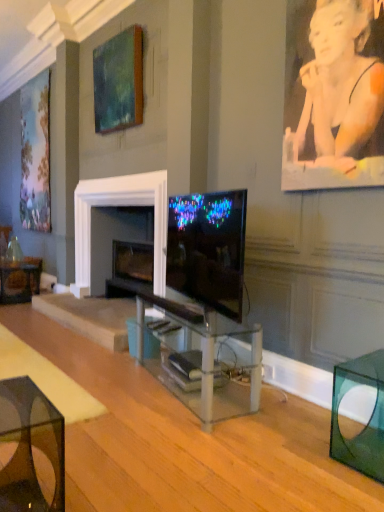
Question: Which direction should I rotate to look at teal matte painting at upper center, arranged as the 2th picture frame when viewed from the left?

Choices:
 (A) right
 (B) left

Answer: (B)

Question: From a real-world perspective, does transparent glass table at lower left, arranged as the second table when viewed from the left, sit lower than transparent glass cube at lower right, the 1th table positioned from the right?

Choices:
 (A) no
 (B) yes

Answer: (B)

Question: Is transparent glass table at lower left, positioned as the third table in right-to-left order, facing away from transparent glass cube at lower right, the 1th table positioned from the right?

Choices:
 (A) yes
 (B) no

Answer: (B)

Question: Considering the relative sizes of transparent glass table at lower left, which ranks as the 1th table in front-to-back order, and transparent glass cube at lower right, the 2th table in the front-to-back sequence, in the image provided, is transparent glass table at lower left, which ranks as the 1th table in front-to-back order, bigger than transparent glass cube at lower right, the 2th table in the front-to-back sequence,?

Choices:
 (A) no
 (B) yes

Answer: (A)

Question: From a real-world perspective, is transparent glass table at lower left, which ranks as the 1th table in front-to-back order, located higher than transparent glass cube at lower right, the 1th table positioned from the right?

Choices:
 (A) no
 (B) yes

Answer: (A)

Question: Considering the relative sizes of transparent glass table at lower left, positioned as the third table in right-to-left order, and transparent glass cube at lower right, the 1th table positioned from the right, in the image provided, is transparent glass table at lower left, positioned as the third table in right-to-left order, wider than transparent glass cube at lower right, the 1th table positioned from the right,?

Choices:
 (A) yes
 (B) no

Answer: (A)

Question: Would you say transparent glass table at lower left, positioned as the 4th table in back-to-front order, is outside transparent glass cube at lower right, the third table from the back?

Choices:
 (A) no
 (B) yes

Answer: (B)

Question: Could you tell me if translucent glass table at lower left, which ranks as the 1th table in back-to-front order, is turned towards smooth skin portrait at upper right?

Choices:
 (A) no
 (B) yes

Answer: (B)

Question: Considering the relative sizes of translucent glass table at lower left, which ranks as the 1th table in back-to-front order, and smooth skin portrait at upper right in the image provided, is translucent glass table at lower left, which ranks as the 1th table in back-to-front order, taller than smooth skin portrait at upper right?

Choices:
 (A) yes
 (B) no

Answer: (B)

Question: Considering the relative positions of translucent glass table at lower left, the first table from the left, and smooth skin portrait at upper right in the image provided, is translucent glass table at lower left, the first table from the left, to the right of smooth skin portrait at upper right from the viewer's perspective?

Choices:
 (A) no
 (B) yes

Answer: (A)

Question: From the image's perspective, is translucent glass table at lower left, arranged as the 4th table when viewed from the right, over smooth skin portrait at upper right?

Choices:
 (A) yes
 (B) no

Answer: (B)

Question: From a real-world perspective, is translucent glass table at lower left, the 4th table from the front, on smooth skin portrait at upper right?

Choices:
 (A) no
 (B) yes

Answer: (A)

Question: Are translucent glass table at lower left, the 4th table from the front, and smooth skin portrait at upper right far apart?

Choices:
 (A) yes
 (B) no

Answer: (A)

Question: Is black plastic remote control at center, the 2th remote control viewed from the front, outside teal matte painting at upper center, positioned as the 1th picture frame in front-to-back order?

Choices:
 (A) yes
 (B) no

Answer: (A)